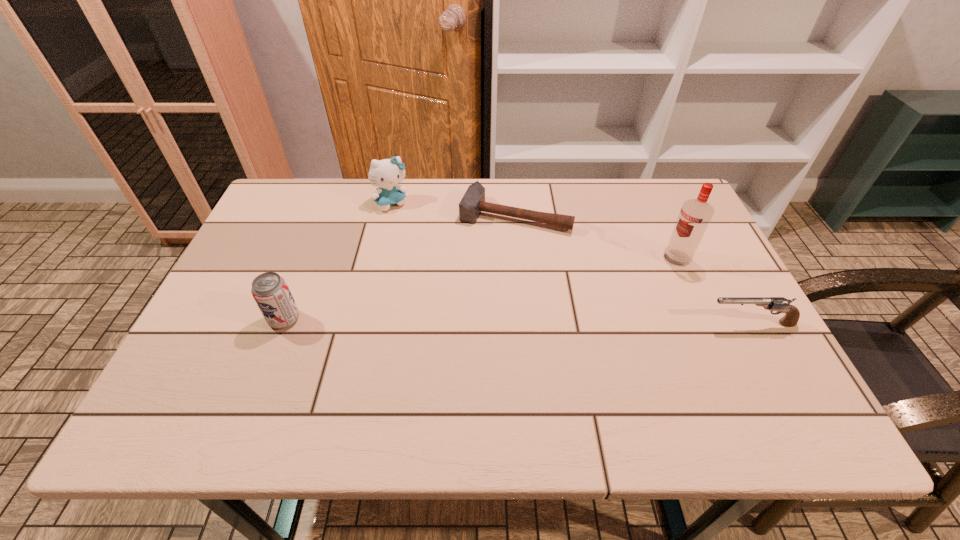
Find the location of a particular element. empty location between the fourth tallest object and the second object from left to right is located at coordinates (571, 262).

Where is `empty space that is in between the vodka and the third shortest object`? Image resolution: width=960 pixels, height=540 pixels. empty space that is in between the vodka and the third shortest object is located at coordinates (481, 289).

You are a GUI agent. You are given a task and a screenshot of the screen. Output one action in this format:
    pyautogui.click(x=<x>, y=<y>)
    Task: Click on the fourth closest object to the gun
    
    Given the screenshot: What is the action you would take?
    pyautogui.click(x=270, y=291)

Identify which object is the third nearest to the shortest object. Please provide its 2D coordinates. Your answer should be formatted as a tuple, i.e. [(x, y)], where the tuple contains the x and y coordinates of a point satisfying the conditions above.

[(780, 304)]

Where is `vacant position in the image that satisfies the following two spatial constraints: 1. on the back side of the tallest object; 2. on the right side of the leftmost object`? vacant position in the image that satisfies the following two spatial constraints: 1. on the back side of the tallest object; 2. on the right side of the leftmost object is located at coordinates (308, 259).

You are a GUI agent. You are given a task and a screenshot of the screen. Output one action in this format:
    pyautogui.click(x=<x>, y=<y>)
    Task: Click on the blank space that satisfies the following two spatial constraints: 1. on the front side of the gun; 2. aiming along the barrel of the third object from left to right
    
    Given the screenshot: What is the action you would take?
    pyautogui.click(x=525, y=323)

Where is `free space that satisfies the following two spatial constraints: 1. on the front side of the kitten; 2. on the left side of the vodka`? Image resolution: width=960 pixels, height=540 pixels. free space that satisfies the following two spatial constraints: 1. on the front side of the kitten; 2. on the left side of the vodka is located at coordinates (379, 259).